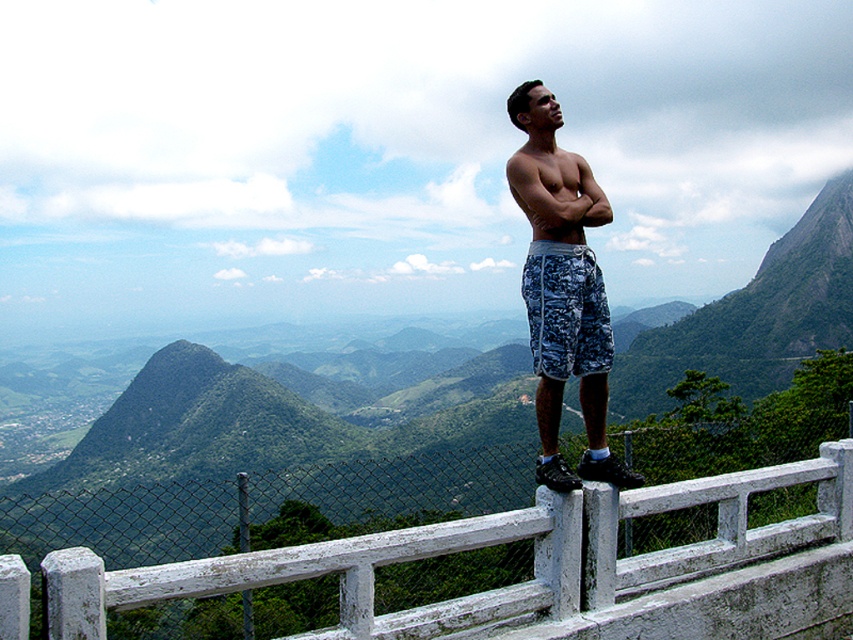
Is white concrete fence at upper center taller than muscular tan skin at upper center?

Yes.

Identify the location of white concrete fence at upper center. (540, 566).

Identify the location of white concrete fence at upper center. (540, 566).

Between point (585, 316) and point (587, 188), which one is positioned in front?

Point (585, 316)

Locate an element on the screen. camouflage fabric shorts at center is located at coordinates (566, 310).

Between camouflage shorts at center and muscular tan skin at upper center, which one has more height?

With more height is camouflage shorts at center.

Which is in front, point (547, 200) or point (602, 193)?

Point (547, 200) is in front.

This screenshot has height=640, width=853. What do you see at coordinates (561, 289) in the screenshot?
I see `camouflage shorts at center` at bounding box center [561, 289].

Locate an element on the screen. This screenshot has height=640, width=853. camouflage shorts at center is located at coordinates (561, 289).